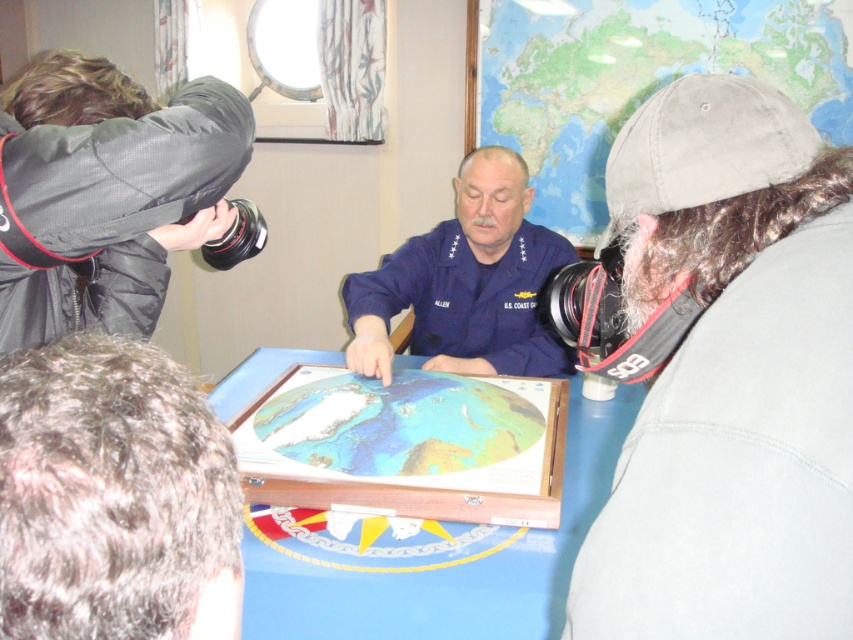
At what (x,y) coordinates should I click in order to perform the action: click on dark brown hair at lower left. Please return your answer as a coordinate pair (x, y). Looking at the image, I should click on (113, 497).

Does dark brown hair at lower left have a lesser width compared to light blue paper map at center?

Yes, dark brown hair at lower left is thinner than light blue paper map at center.

Who is more forward, (3, 428) or (376, 385)?

Point (3, 428)

Identify the location of dark brown hair at lower left. The height and width of the screenshot is (640, 853). (113, 497).

Is navy blue uniform at center shorter than light blue paper map at center?

No.

Which is more to the right, navy blue uniform at center or light blue paper map at center?

navy blue uniform at center is more to the right.

Which is behind, point (527, 189) or point (257, 413)?

Point (527, 189)

Find the location of a particular element. navy blue uniform at center is located at coordinates (465, 282).

Is point (200, 177) behind point (529, 476)?

No, (200, 177) is closer to viewer.

This screenshot has width=853, height=640. I want to click on black fabric camera at left, so click(x=106, y=193).